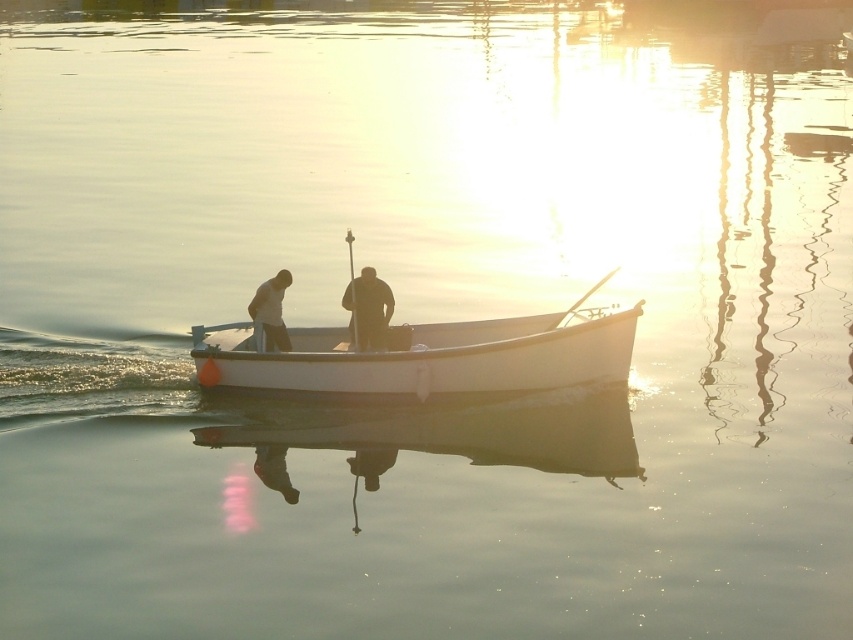
You are a photographer trying to capture a closeup of both the dark brown leather jacket at center and the smooth white shirt at center in the image. Given that your camera can only focus on objects within a 0.8 meters range, will you be able to capture both in focus?

The dark brown leather jacket at center and the smooth white shirt at center are 1.00 meters apart. Since the camera can only focus within 0.8 meters, the distance between them exceeds the focus range. Therefore, you cannot capture both in focus simultaneously.

You are standing on the dock and see the point marked at coordinates [431,356]. What object is located at that point?

The point at [431,356] indicates the white matte canoe at center.

You are a photographer trying to capture the scene of the white matte canoe at center and the dark brown leather jacket at center. Since both are at the center, how can you determine their relative positions in the photo?

The white matte canoe at center is positioned under the dark brown leather jacket at center, so in the photo, the dark brown leather jacket at center will appear above the white matte canoe at center.